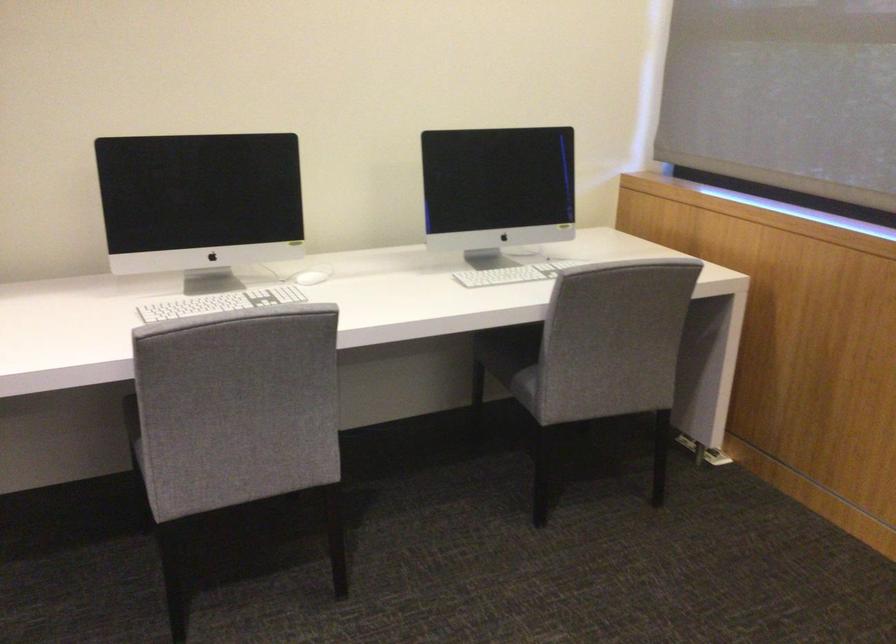
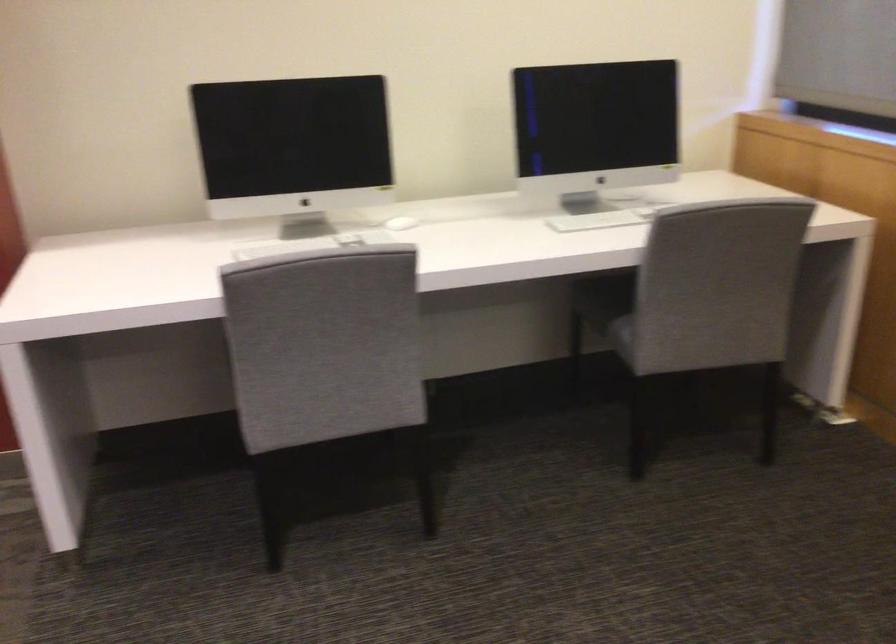
Question: The camera is either moving clockwise (left) or counter-clockwise (right) around the object. The first image is from the beginning of the video and the second image is from the end. Is the camera moving left or right when shooting the video?

Choices:
 (A) Left
 (B) Right

Answer: (B)